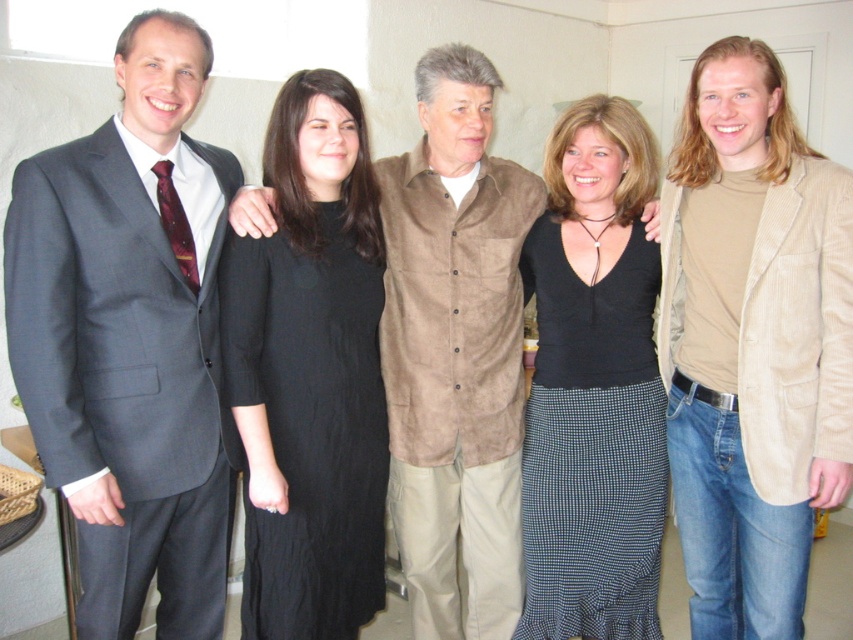
Between point (100, 266) and point (373, 534), which one is positioned in front?

Point (100, 266) is more forward.

Measure the distance between matte gray suit at left and camera.

The distance of matte gray suit at left from camera is 1.56 meters.

Identify the location of matte gray suit at left. This screenshot has height=640, width=853. (131, 339).

Does black dress at center appear under black cotton dress at center?

Yes, black dress at center is below black cotton dress at center.

Is black dress at center smaller than black cotton dress at center?

No, black dress at center is not smaller than black cotton dress at center.

Does point (730, 257) come farther from viewer compared to point (267, 483)?

Yes, it is.

At what (x,y) coordinates should I click in order to perform the action: click on black dress at center. Please return your answer as a coordinate pair (x, y). This screenshot has width=853, height=640. Looking at the image, I should click on (752, 342).

Between point (775, 99) and point (656, 385), which one is positioned behind?

Positioned behind is point (656, 385).

Does point (697, 218) come behind point (653, 417)?

No, (697, 218) is closer to viewer.

At what (x,y) coordinates should I click in order to perform the action: click on black dress at center. Please return your answer as a coordinate pair (x, y). The height and width of the screenshot is (640, 853). Looking at the image, I should click on (752, 342).